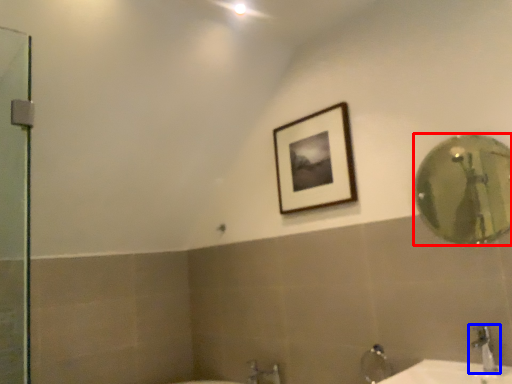
Question: Which object appears closest to the camera in this image, mirror (highlighted by a red box) or tap (highlighted by a blue box)?

Choices:
 (A) mirror
 (B) tap

Answer: (B)